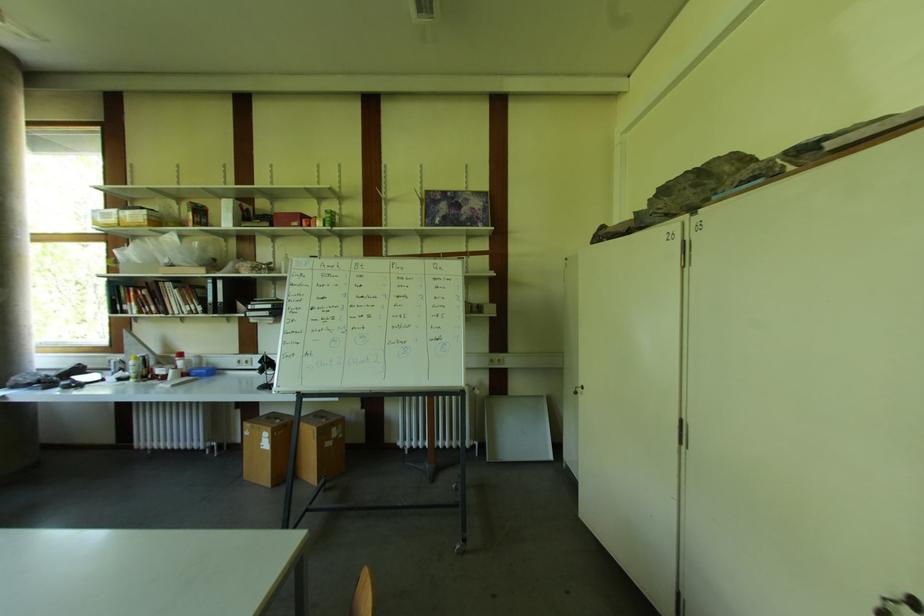
What are the coordinates of `red capped bottle` in the screenshot? It's located at coord(287,219).